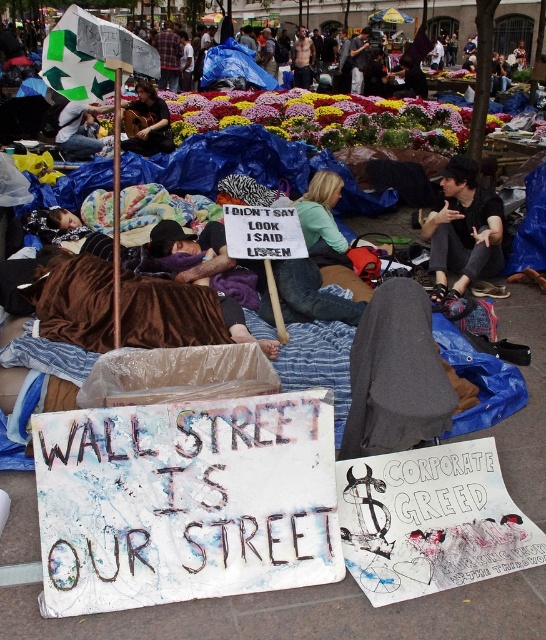
You are a photographer trying to capture both the green fabric shirt at center and the green fabric sign at upper left in a single frame. Which object should you focus on to ensure both are visible without cropping?

You should focus on the green fabric sign at upper left because it occupies more space than the green fabric shirt at center, making it easier to include both in the frame.

You are a photographer trying to capture both the matte brown guitar at upper left and the green fabric sign at upper left in a single frame. Given their sizes, which object should you focus on to ensure both are visible without cropping?

The matte brown guitar at upper left is bigger than the green fabric sign at upper left, so you should focus on the matte brown guitar at upper left to ensure both are visible without cropping.

Looking at this image, you are a photographer trying to capture a photo of the green fabric shirt at center and the green fabric sign at upper left. Can you frame both objects in the same shot without moving either of them?

The green fabric shirt at center is located below the green fabric sign at upper left, so yes, you can frame both in the same shot as their positions allow them to be captured together.